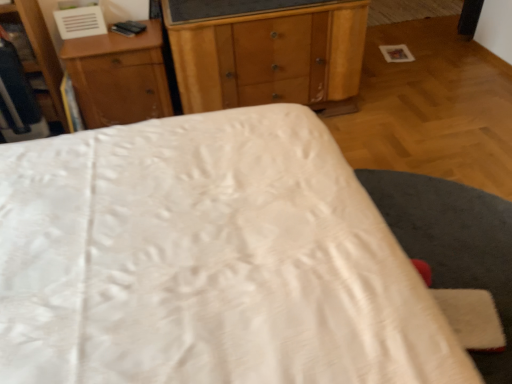
What do you see at coordinates (119, 77) in the screenshot? I see `wooden nightstand at upper center` at bounding box center [119, 77].

This screenshot has width=512, height=384. What do you see at coordinates (208, 260) in the screenshot?
I see `white satin bed at center` at bounding box center [208, 260].

Locate an element on the screen. Image resolution: width=512 pixels, height=384 pixels. wooden nightstand at upper center is located at coordinates (119, 77).

Is wooden dresser at left located outside white satin bed at center?

wooden dresser at left is positioned outside white satin bed at center.

From the image's perspective, which one is positioned lower, wooden dresser at left or white satin bed at center?

white satin bed at center is shown below in the image.

Can you tell me how much wooden dresser at left and white satin bed at center differ in facing direction?

89.6 degrees separate the facing orientations of wooden dresser at left and white satin bed at center.

Is point (136, 43) positioned in front of point (57, 96)?

Yes, point (136, 43) is closer to viewer.

From a real-world perspective, who is located higher, wooden nightstand at upper center or wooden dresser at left?

wooden dresser at left.

Is wooden nightstand at upper center behind wooden dresser at left?

Yes.

Considering the relative sizes of wooden nightstand at upper center and wooden dresser at left in the image provided, is wooden nightstand at upper center smaller than wooden dresser at left?

No, wooden nightstand at upper center is not smaller than wooden dresser at left.

Image resolution: width=512 pixels, height=384 pixels. In order to click on nightstand located underneath the wooden chest of drawers at center (from a real-world perspective) in this screenshot , I will do `click(119, 77)`.

Are wooden nightstand at upper center and wooden chest of drawers at center located far from each other?

Actually, wooden nightstand at upper center and wooden chest of drawers at center are a little close together.

Which object is more forward, wooden nightstand at upper center or wooden chest of drawers at center?

wooden chest of drawers at center is closer to the camera.

From the image's perspective, would you say wooden nightstand at upper center is shown under wooden chest of drawers at center?

Yes, from the image's perspective, wooden nightstand at upper center is below wooden chest of drawers at center.

From a real-world perspective, is white satin bed at center positioned over wooden nightstand at upper center based on gravity?

Yes, from a real-world perspective, white satin bed at center is on top of wooden nightstand at upper center.

The height and width of the screenshot is (384, 512). What are the coordinates of `bed below the wooden nightstand at upper center (from the image's perspective)` in the screenshot? It's located at (208, 260).

Is wooden chest of drawers at center far away from wooden dresser at left?

wooden chest of drawers at center is far away from wooden dresser at left.

How many degrees apart are the facing directions of wooden chest of drawers at center and wooden dresser at left?

They differ by 1.59 degrees in their facing directions.

Between point (317, 72) and point (45, 49), which one is positioned in front?

The point (45, 49) is closer to the camera.

Is wooden chest of drawers at center shorter than wooden dresser at left?

Yes, wooden chest of drawers at center is shorter than wooden dresser at left.

Considering the relative sizes of white satin bed at center and wooden chest of drawers at center in the image provided, is white satin bed at center smaller than wooden chest of drawers at center?

No.

Does white satin bed at center lie in front of wooden chest of drawers at center?

Yes, white satin bed at center is in front of wooden chest of drawers at center.

How many degrees apart are the facing directions of white satin bed at center and wooden chest of drawers at center?

They differ by 91.2 degrees in their facing directions.

Is point (106, 158) behind point (223, 95)?

No, (106, 158) is closer to viewer.

This screenshot has width=512, height=384. There is a wooden chest of drawers at center. Identify the location of bed above it (from a real-world perspective). (208, 260).

Does point (293, 19) come in front of point (197, 205)?

No, (293, 19) is further to viewer.

How many degrees apart are the facing directions of wooden chest of drawers at center and white satin bed at center?

There is a 91.2-degree angle between the facing directions of wooden chest of drawers at center and white satin bed at center.

Based on the photo, from the image's perspective, does wooden chest of drawers at center appear lower than white satin bed at center?

No.

Find the location of a particular element. The height and width of the screenshot is (384, 512). bed that appears below the wooden dresser at left (from the image's perspective) is located at coordinates (208, 260).

The width and height of the screenshot is (512, 384). In order to click on nightstand behind the wooden dresser at left in this screenshot , I will do `click(119, 77)`.

Which object lies further to the anchor point white satin bed at center, wooden chest of drawers at center or wooden nightstand at upper center?

wooden nightstand at upper center is positioned further to the anchor white satin bed at center.

When comparing their distances from wooden dresser at left, does wooden nightstand at upper center or white satin bed at center seem closer?

wooden nightstand at upper center is closer to wooden dresser at left.

Looking at this image, when comparing their distances from wooden nightstand at upper center, does white satin bed at center or wooden chest of drawers at center seem closer?

wooden chest of drawers at center is closer to wooden nightstand at upper center.

Estimate the real-world distances between objects in this image. Which object is closer to wooden nightstand at upper center, wooden chest of drawers at center or white satin bed at center?

wooden chest of drawers at center lies closer to wooden nightstand at upper center than the other object.

From the image, which object appears to be nearer to wooden chest of drawers at center, wooden nightstand at upper center or wooden dresser at left?

Among the two, wooden nightstand at upper center is located nearer to wooden chest of drawers at center.

When comparing their distances from white satin bed at center, does wooden chest of drawers at center or wooden dresser at left seem closer?

wooden chest of drawers at center is positioned closer to the anchor white satin bed at center.

Estimate the real-world distances between objects in this image. Which object is closer to white satin bed at center, wooden dresser at left or wooden chest of drawers at center?

The object closer to white satin bed at center is wooden chest of drawers at center.

Looking at the image, which one is located closer to wooden dresser at left, white satin bed at center or wooden chest of drawers at center?

wooden chest of drawers at center.

At what (x,y) coordinates should I click in order to perform the action: click on dresser located between white satin bed at center and wooden nightstand at upper center in the depth direction. Please return your answer as a coordinate pair (x, y). This screenshot has height=384, width=512. Looking at the image, I should click on 39,50.

Locate an element on the screen. This screenshot has height=384, width=512. dresser positioned between white satin bed at center and wooden chest of drawers at center from near to far is located at coordinates (39, 50).

I want to click on the chest of drawers located between white satin bed at center and wooden nightstand at upper center in the depth direction, so click(x=266, y=51).

You are a GUI agent. You are given a task and a screenshot of the screen. Output one action in this format:
    pyautogui.click(x=<x>, y=<y>)
    Task: Click on the nightstand between wooden dresser at left and wooden chest of drawers at center from left to right
    The width and height of the screenshot is (512, 384).
    Given the screenshot: What is the action you would take?
    pyautogui.click(x=119, y=77)